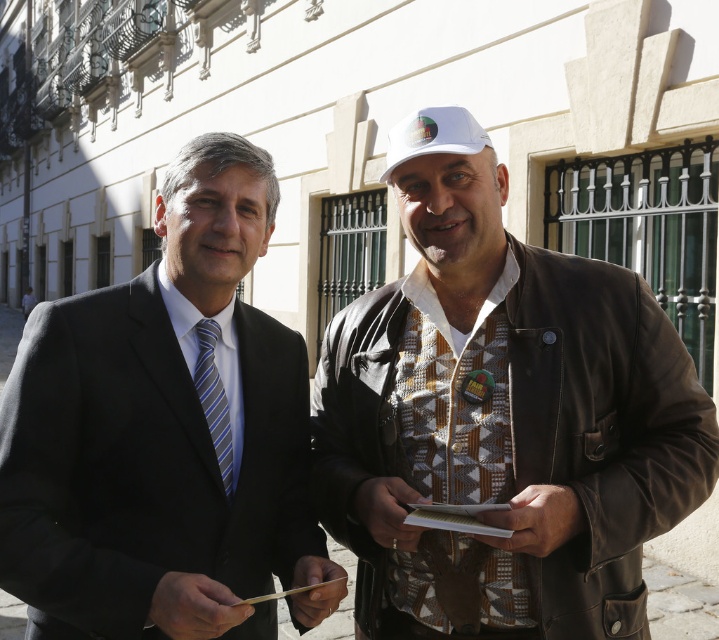
Is point (459, 124) closer to viewer compared to point (219, 433)?

No, it is not.

Does white matte baseball cap at upper center have a greater height compared to blue striped tie at left?

Incorrect, white matte baseball cap at upper center's height is not larger of blue striped tie at left's.

Who is more distant from viewer, (459, 138) or (228, 486)?

The point (228, 486) is behind.

You are a GUI agent. You are given a task and a screenshot of the screen. Output one action in this format:
    pyautogui.click(x=<x>, y=<y>)
    Task: Click on the white matte baseball cap at upper center
    The height and width of the screenshot is (640, 719).
    Given the screenshot: What is the action you would take?
    pyautogui.click(x=434, y=134)

Can you confirm if matte black suit at center is bigger than white matte baseball cap at upper center?

Yes, matte black suit at center is bigger than white matte baseball cap at upper center.

Which is below, matte black suit at center or white matte baseball cap at upper center?

matte black suit at center is below.

Does point (91, 392) lie in front of point (398, 156)?

Yes, point (91, 392) is in front of point (398, 156).

Locate an element on the screen. Image resolution: width=719 pixels, height=640 pixels. matte black suit at center is located at coordinates (162, 435).

Image resolution: width=719 pixels, height=640 pixels. What do you see at coordinates (162, 435) in the screenshot?
I see `matte black suit at center` at bounding box center [162, 435].

This screenshot has width=719, height=640. Identify the location of matte black suit at center. (162, 435).

Does point (209, 440) come farther from viewer compared to point (462, 529)?

Yes, it is behind point (462, 529).

Locate an element on the screen. The image size is (719, 640). matte black suit at center is located at coordinates (162, 435).